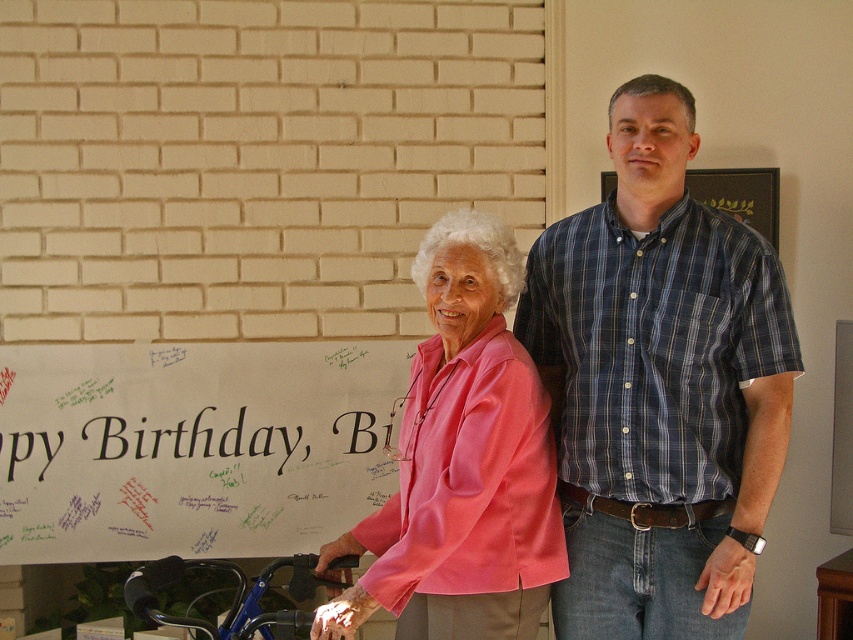
You are a photographer at a birthday party and need to position yourself so that both the blue plaid shirt at center and the blue plastic wheelchair at lower left are in frame. The minimum distance between the two objects to ensure both are visible is 32.29 inches. Can you estimate if your camera with a 35mm lens can capture both in a single shot?

The blue plaid shirt at center and blue plastic wheelchair at lower left are 32.29 inches apart. A 35mm lens typically has a field of view that can accommodate objects within this distance, so yes, the camera can capture both in a single shot.